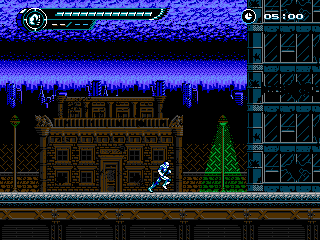
Where is `second half of gif shows black and blue checkered walls`? This screenshot has height=240, width=320. second half of gif shows black and blue checkered walls is located at coordinates (177, 111), (168, 80), (222, 176).